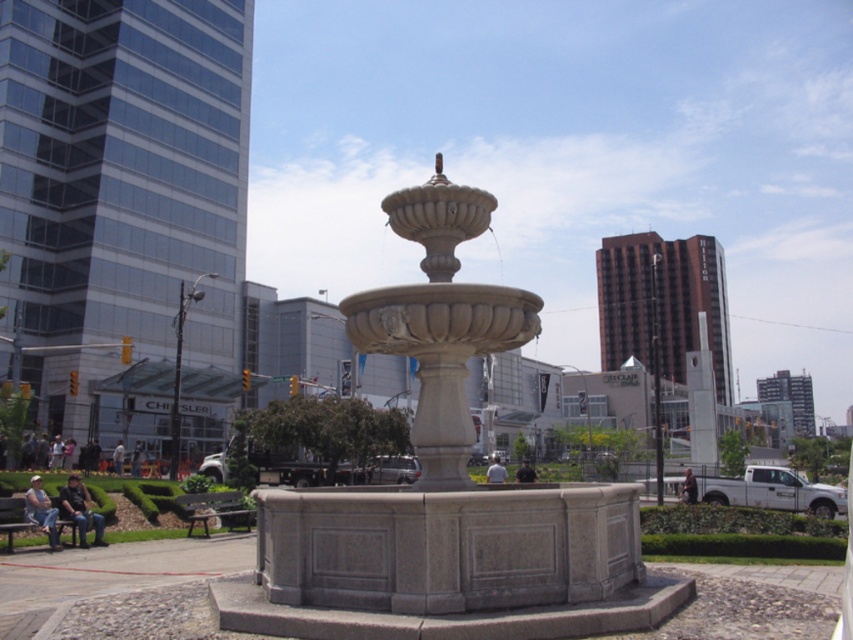
Who is positioned more to the left, gray stone fountain at center or wooden park bench at lower left?

wooden park bench at lower left is more to the left.

Between gray stone fountain at center and wooden park bench at lower left, which one has less height?

Standing shorter between the two is gray stone fountain at center.

Is point (401, 234) less distant than point (194, 509)?

Yes, point (401, 234) is closer to viewer.

Identify the location of gray stone fountain at center. This screenshot has width=853, height=640. tap(445, 492).

Is wooden park bench at lower left to the left of green wooden bench at lower left from the viewer's perspective?

No, wooden park bench at lower left is not to the left of green wooden bench at lower left.

Consider the image. Can you confirm if wooden park bench at lower left is thinner than green wooden bench at lower left?

No.

Measure the distance between point (216, 502) and camera.

They are 18.38 meters apart.

This screenshot has width=853, height=640. In order to click on wooden park bench at lower left in this screenshot , I will do `click(215, 509)`.

Is gray stone fountain at center in front of green wooden bench at lower left?

Yes.

Is gray stone fountain at center taller than green wooden bench at lower left?

No, gray stone fountain at center is not taller than green wooden bench at lower left.

Is point (480, 500) closer to camera compared to point (15, 515)?

That is True.

You are a GUI agent. You are given a task and a screenshot of the screen. Output one action in this format:
    pyautogui.click(x=<x>, y=<y>)
    Task: Click on the gray stone fountain at center
    
    Given the screenshot: What is the action you would take?
    coord(445,492)